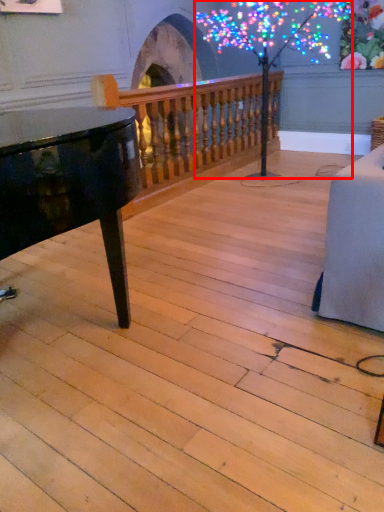
Question: Considering the relative positions of tree (annotated by the red box) and rail in the image provided, where is tree (annotated by the red box) located with respect to the staircase?

Choices:
 (A) left
 (B) right

Answer: (B)